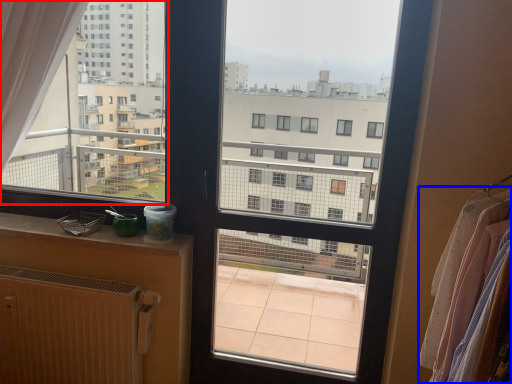
Question: Which object appears closest to the camera in this image, condominium (highlighted by a red box) or clothing (highlighted by a blue box)?

Choices:
 (A) condominium
 (B) clothing

Answer: (B)